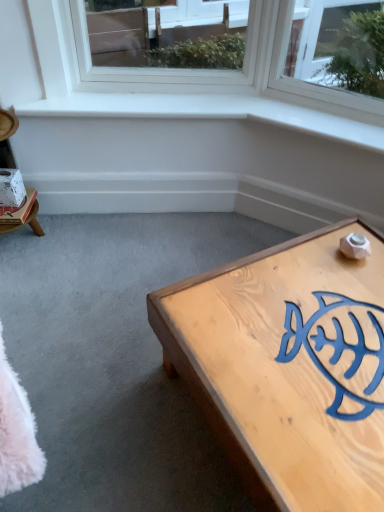
What do you see at coordinates (285, 368) in the screenshot?
I see `light wood coffee table at lower right` at bounding box center [285, 368].

The width and height of the screenshot is (384, 512). Find the location of `white paper at left`. white paper at left is located at coordinates (12, 188).

Locate an element on the screen. white cardboard box at left is located at coordinates (23, 215).

In the scene shown: From the image's perspective, is light wood coffee table at lower right below white cardboard box at left?

Indeed, from the image's perspective, light wood coffee table at lower right is shown beneath white cardboard box at left.

Is light wood coffee table at lower right not within white cardboard box at left?

Yes.

Between light wood coffee table at lower right and white cardboard box at left, which one is positioned in front?

light wood coffee table at lower right is in front.

From a real-world perspective, is light wood coffee table at lower right positioned over white cardboard box at left based on gravity?

Yes, from a real-world perspective, light wood coffee table at lower right is over white cardboard box at left

Is white cardboard box at left thinner than light wood coffee table at lower right?

Correct, the width of white cardboard box at left is less than that of light wood coffee table at lower right.

From the image's perspective, is white cardboard box at left on top of light wood coffee table at lower right?

Yes.

Looking at this image, is white cardboard box at left not within light wood coffee table at lower right?

That's correct, white cardboard box at left is outside of light wood coffee table at lower right.

Is white paper at left oriented away from white cardboard box at left?

No, white paper at left is not facing away from white cardboard box at left.

Consider the image. How much distance is there between white paper at left and white cardboard box at left?

white paper at left and white cardboard box at left are 3.48 inches apart.

Consider the image. Is white paper at left positioned before white cardboard box at left?

Yes, white paper at left is closer to the camera.

Does point (14, 186) lie in front of point (3, 230)?

Yes.

Consider the image. Is white paper at left smaller than light wood coffee table at lower right?

Yes.

Are white paper at left and light wood coffee table at lower right located far from each other?

white paper at left is far away from light wood coffee table at lower right.

In terms of width, does white paper at left look wider or thinner when compared to light wood coffee table at lower right?

Clearly, white paper at left has less width compared to light wood coffee table at lower right.

Does white paper at left come behind light wood coffee table at lower right?

Yes, it is.

Considering the sizes of objects light wood coffee table at lower right and white paper at left in the image provided, who is bigger, light wood coffee table at lower right or white paper at left?

light wood coffee table at lower right.

Does light wood coffee table at lower right come behind white paper at left?

No, light wood coffee table at lower right is closer to the camera.

From a real-world perspective, which object stands above the other?

white paper at left.

Considering the points (358, 479) and (23, 201), which point is in front, point (358, 479) or point (23, 201)?

The point (358, 479) is more forward.

Could you tell me if white cardboard box at left is turned towards white paper at left?

No, white cardboard box at left does not turn towards white paper at left.

Is point (25, 214) positioned in front of point (10, 178)?

No, it is behind (10, 178).

Between white cardboard box at left and white paper at left, which one appears on the left side from the viewer's perspective?

From the viewer's perspective, white cardboard box at left appears more on the left side.

Can you tell me how much white cardboard box at left and white paper at left differ in facing direction?

There is a 0.0315-degree angle between the facing directions of white cardboard box at left and white paper at left.

The height and width of the screenshot is (512, 384). I want to click on furniture that appears behind the light wood coffee table at lower right, so click(x=23, y=215).

Identify the location of furniture below the light wood coffee table at lower right (from a real-world perspective). Image resolution: width=384 pixels, height=512 pixels. (23, 215).

Estimate the real-world distances between objects in this image. Which object is closer to light wood coffee table at lower right, white cardboard box at left or white paper at left?

white cardboard box at left is positioned closer to the anchor light wood coffee table at lower right.

In the scene shown: From the image, which object appears to be farther from white cardboard box at left, light wood coffee table at lower right or white paper at left?

Among the two, light wood coffee table at lower right is located further to white cardboard box at left.

When comparing their distances from white paper at left, does light wood coffee table at lower right or white cardboard box at left seem further?

The object further to white paper at left is light wood coffee table at lower right.

Considering their positions, is white cardboard box at left positioned closer to white paper at left than light wood coffee table at lower right?

The object closer to white paper at left is white cardboard box at left.

Based on their spatial positions, is white paper at left or light wood coffee table at lower right further from white cardboard box at left?

light wood coffee table at lower right is further to white cardboard box at left.

Based on their spatial positions, is white paper at left or white cardboard box at left further from light wood coffee table at lower right?

white paper at left lies further to light wood coffee table at lower right than the other object.

In order to click on box between white cardboard box at left and light wood coffee table at lower right in this screenshot , I will do `click(12, 188)`.